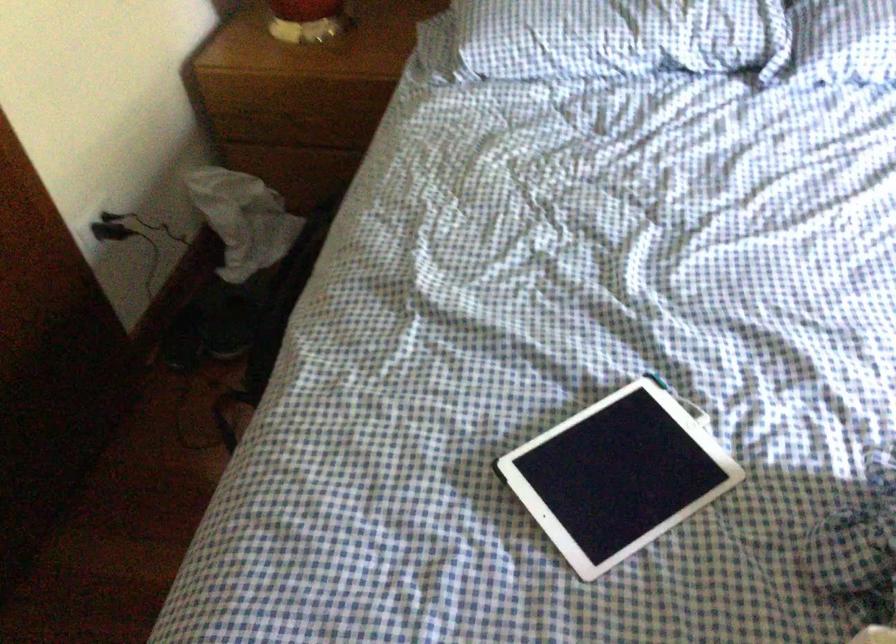
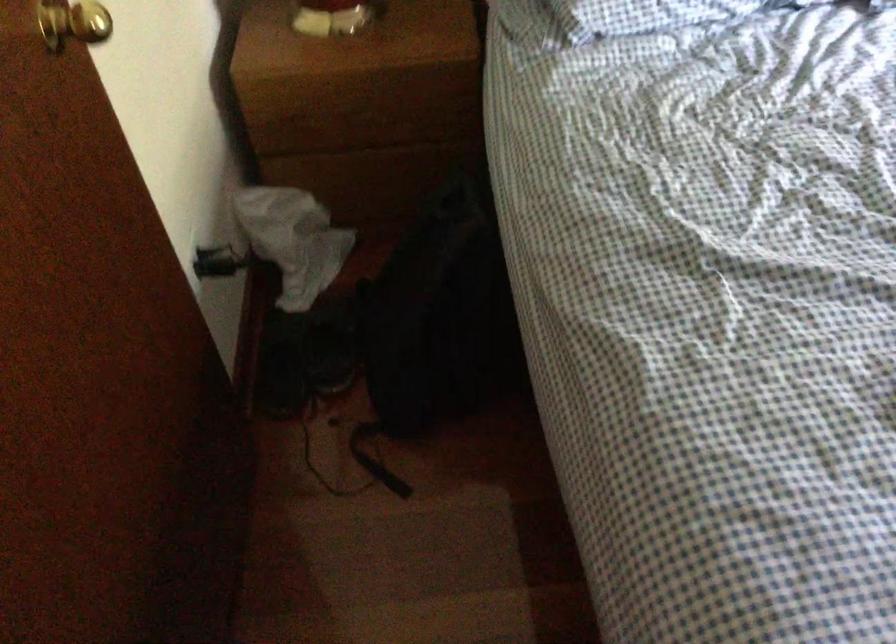
Where in the second image is the point corresponding to the point at 195,323 from the first image?

(282, 363)